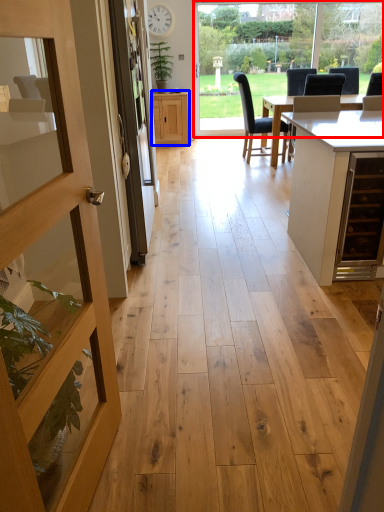
Question: Which of the following is the farthest to the observer, window frame (highlighted by a red box) or cabinetry (highlighted by a blue box)?

Choices:
 (A) window frame
 (B) cabinetry

Answer: (B)